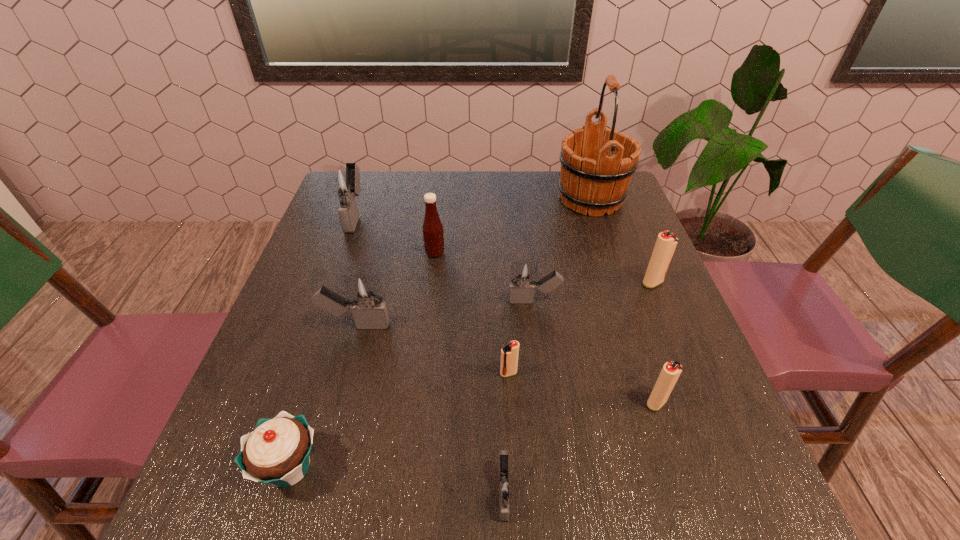
At what (x,y) coordinates should I click in order to perform the action: click on free space located 0.180m on the front of the farthest igniter. Please return your answer as a coordinate pair (x, y). The height and width of the screenshot is (540, 960). Looking at the image, I should click on (332, 281).

Locate an element on the screen. vacant space located 0.250m on the right of the fourth object from left to right is located at coordinates (543, 253).

In order to click on free space located 0.210m on the left of the rightmost igniter in this screenshot , I will do `click(552, 283)`.

Locate an element on the screen. vacant space situated on the right of the second biggest gray igniter is located at coordinates (469, 325).

The image size is (960, 540). In order to click on vacant space located on the right of the second smallest gray igniter in this screenshot , I will do `click(662, 301)`.

Where is `vacant space located 0.290m on the back of the second igniter from right to left`? vacant space located 0.290m on the back of the second igniter from right to left is located at coordinates (618, 285).

I want to click on blank space located on the back of the teal cupcake, so click(x=349, y=276).

You are a GUI agent. You are given a task and a screenshot of the screen. Output one action in this format:
    pyautogui.click(x=<x>, y=<y>)
    Task: Click on the vacant space located 0.270m on the back of the smallest red igniter
    The height and width of the screenshot is (540, 960).
    Given the screenshot: What is the action you would take?
    pyautogui.click(x=503, y=275)

This screenshot has width=960, height=540. Identify the location of free space located 0.130m on the back of the nearest igniter. (500, 395).

Find the location of a particular element. This screenshot has width=960, height=540. wine bucket located at the far edge is located at coordinates (593, 178).